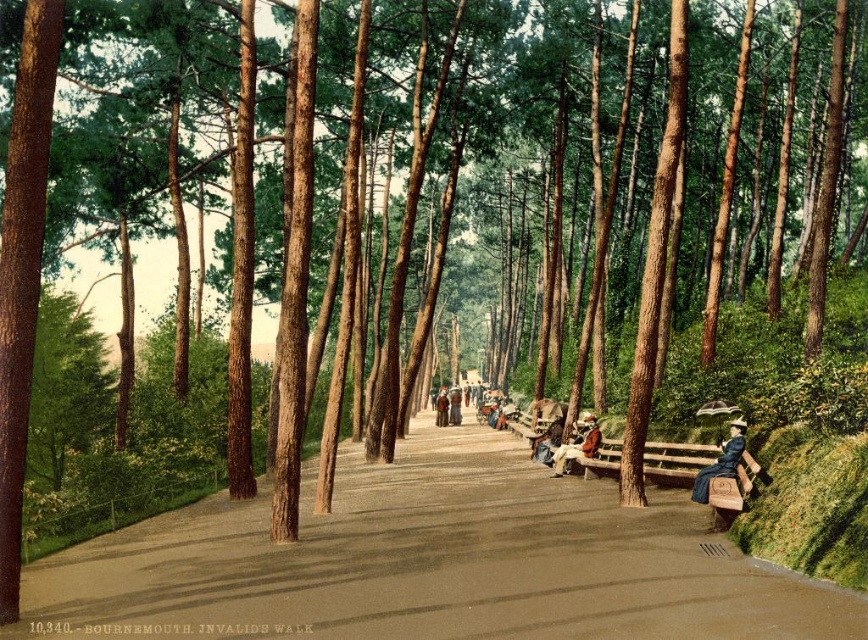
You are standing at the entrance of the park and want to walk towards the two points marked in the image. Which point, point (659,536) or point (584,433), is closer to you?

Point (659,536) is closer to the viewer than point (584,433).